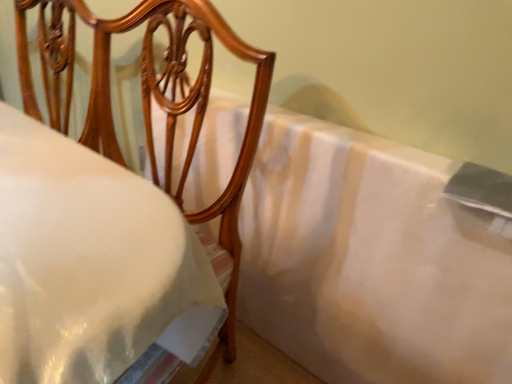
Question: From the image's perspective, is white satin bedsheet at center below matte wood chair at upper left?

Choices:
 (A) yes
 (B) no

Answer: (A)

Question: Is white satin bedsheet at center to the right of matte wood chair at upper left from the viewer's perspective?

Choices:
 (A) yes
 (B) no

Answer: (A)

Question: Is white satin bedsheet at center further to camera compared to matte wood chair at upper left?

Choices:
 (A) yes
 (B) no

Answer: (A)

Question: From the image's perspective, is white satin bedsheet at center above matte wood chair at upper left?

Choices:
 (A) yes
 (B) no

Answer: (B)

Question: Considering the relative sizes of white satin bedsheet at center and matte wood chair at upper left in the image provided, is white satin bedsheet at center shorter than matte wood chair at upper left?

Choices:
 (A) yes
 (B) no

Answer: (A)

Question: From a real-world perspective, does white satin bedsheet at center sit lower than matte wood chair at upper left?

Choices:
 (A) no
 (B) yes

Answer: (B)

Question: From a real-world perspective, is matte wood chair at upper left on white satin bedsheet at center?

Choices:
 (A) no
 (B) yes

Answer: (B)

Question: Considering the relative positions of matte wood chair at upper left and white satin bedsheet at center in the image provided, is matte wood chair at upper left behind white satin bedsheet at center?

Choices:
 (A) no
 (B) yes

Answer: (A)

Question: Does matte wood chair at upper left have a greater width compared to white satin bedsheet at center?

Choices:
 (A) yes
 (B) no

Answer: (A)

Question: Is matte wood chair at upper left facing towards white satin bedsheet at center?

Choices:
 (A) no
 (B) yes

Answer: (A)

Question: Is matte wood chair at upper left positioned with its back to white satin bedsheet at center?

Choices:
 (A) yes
 (B) no

Answer: (A)

Question: Can you confirm if matte wood chair at upper left is bigger than white satin bedsheet at center?

Choices:
 (A) yes
 (B) no

Answer: (A)

Question: Considering the positions of point (233, 178) and point (470, 365), is point (233, 178) closer or farther from the camera than point (470, 365)?

Choices:
 (A) closer
 (B) farther

Answer: (A)